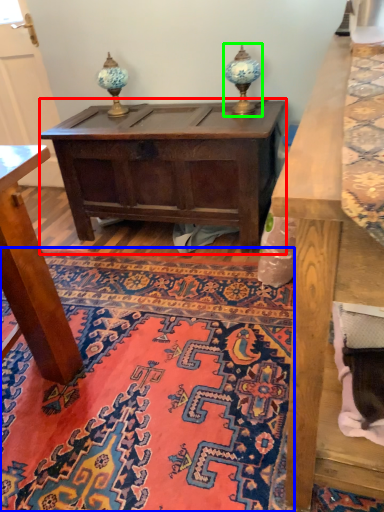
Question: Which object is the closest to the table (highlighted by a red box)? Choose among these: mat (highlighted by a blue box) or table lamp (highlighted by a green box).

Choices:
 (A) mat
 (B) table lamp

Answer: (B)